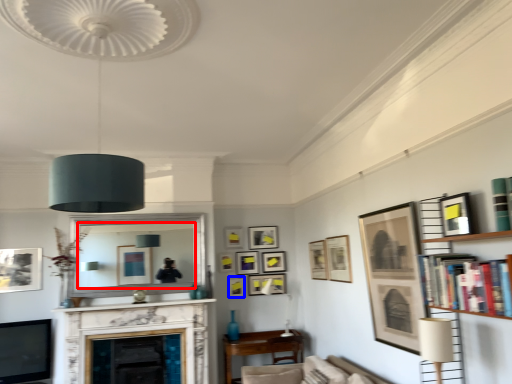
Question: Which point is closer to the camera, mirror (highlighted by a red box) or picture frame (highlighted by a blue box)?

Choices:
 (A) mirror
 (B) picture frame

Answer: (A)